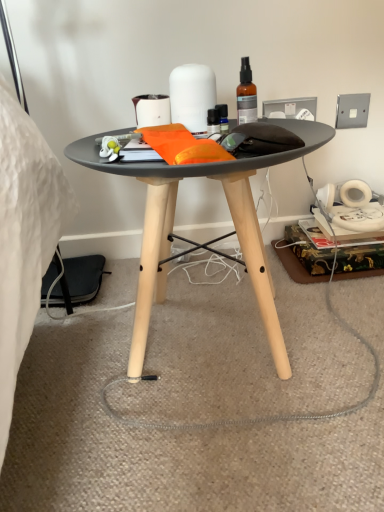
Question: Is matte white toilet paper at upper center, arranged as the 2th toilet paper when viewed from the right, touching translucent amber glass spray bottle at upper center?

Choices:
 (A) yes
 (B) no

Answer: (B)

Question: From a real-world perspective, is matte white toilet paper at upper center, arranged as the 2th toilet paper when viewed from the right, located higher than translucent amber glass spray bottle at upper center?

Choices:
 (A) no
 (B) yes

Answer: (A)

Question: Is matte white toilet paper at upper center, which is the 1th toilet paper from left to right, shorter than translucent amber glass spray bottle at upper center?

Choices:
 (A) yes
 (B) no

Answer: (A)

Question: Considering the relative positions of matte white toilet paper at upper center, arranged as the 2th toilet paper when viewed from the right, and translucent amber glass spray bottle at upper center in the image provided, is matte white toilet paper at upper center, arranged as the 2th toilet paper when viewed from the right, behind translucent amber glass spray bottle at upper center?

Choices:
 (A) yes
 (B) no

Answer: (A)

Question: Can you confirm if matte white toilet paper at upper center, which is the 1th toilet paper from left to right, is wider than translucent amber glass spray bottle at upper center?

Choices:
 (A) no
 (B) yes

Answer: (B)

Question: Considering the relative sizes of matte white toilet paper at upper center, arranged as the 2th toilet paper when viewed from the right, and translucent amber glass spray bottle at upper center in the image provided, is matte white toilet paper at upper center, arranged as the 2th toilet paper when viewed from the right, taller than translucent amber glass spray bottle at upper center?

Choices:
 (A) yes
 (B) no

Answer: (B)

Question: Considering the relative sizes of white matte diffuser at upper center, which is the first toilet paper in right-to-left order, and translucent amber glass spray bottle at upper center in the image provided, is white matte diffuser at upper center, which is the first toilet paper in right-to-left order, smaller than translucent amber glass spray bottle at upper center?

Choices:
 (A) no
 (B) yes

Answer: (A)

Question: Is the depth of white matte diffuser at upper center, which is the first toilet paper in right-to-left order, greater than that of translucent amber glass spray bottle at upper center?

Choices:
 (A) no
 (B) yes

Answer: (B)

Question: Is white matte diffuser at upper center, the 2th toilet paper when ordered from left to right, located outside translucent amber glass spray bottle at upper center?

Choices:
 (A) no
 (B) yes

Answer: (B)

Question: Is white matte diffuser at upper center, the 2th toilet paper when ordered from left to right, to the right of translucent amber glass spray bottle at upper center from the viewer's perspective?

Choices:
 (A) no
 (B) yes

Answer: (A)

Question: Is white matte diffuser at upper center, the 2th toilet paper when ordered from left to right, thinner than translucent amber glass spray bottle at upper center?

Choices:
 (A) yes
 (B) no

Answer: (B)

Question: Can we say matte white toilet paper at upper center, arranged as the 2th toilet paper when viewed from the right, lies outside matte black table at center?

Choices:
 (A) no
 (B) yes

Answer: (B)